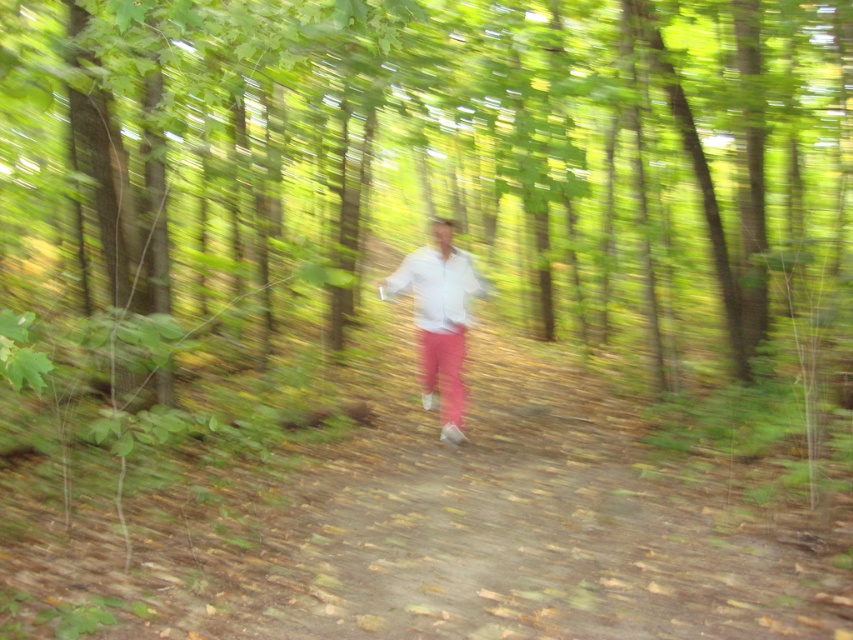
Question: Can you confirm if green leafy tree at center is positioned to the left of white matte shirt at center?

Choices:
 (A) yes
 (B) no

Answer: (B)

Question: Does green leafy tree at center appear on the right side of white matte shirt at center?

Choices:
 (A) no
 (B) yes

Answer: (B)

Question: Is green leafy tree at center wider than white matte shirt at center?

Choices:
 (A) no
 (B) yes

Answer: (B)